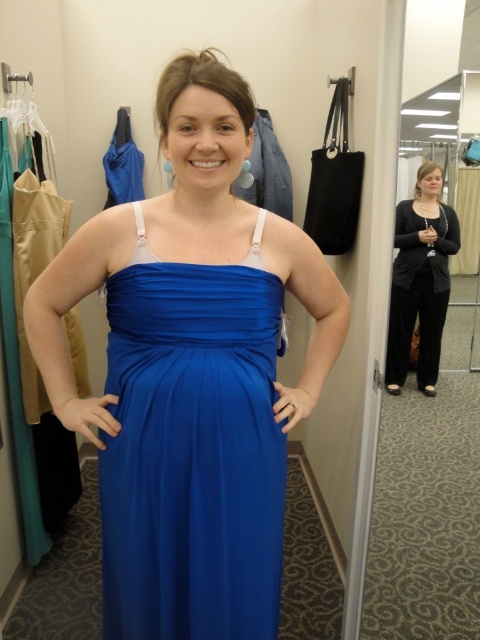
You are a fashion designer trying to decide whether to place the royal satin dress at center and the black matte cardigan at center on the same display rack. The rack has a width of 1.2 meters. Can both items fit side by side without overlapping?

The royal satin dress at center might be wider than the black matte cardigan at center, so it is uncertain if both can fit on the 1.2 meter rack. Check their individual widths first.

You are a fashion designer who needs to take precise measurements of the royal satin dress at center. You have a measuring tape that can extend up to 38 inches. Can you accurately measure the dress from where you are standing?

The royal satin dress at center is 37.98 inches away from viewer, so yes, the measuring tape can reach it since its maximum extension is 38 inches, which is just enough to measure the dress.

You are a fashion stylist helping a client choose between the royal blue satin dress at center and the black matte cardigan at center. The client wants to wear the item that is narrower. Which one should you recommend?

The royal blue satin dress at center is thinner than the black matte cardigan at center, so you should recommend the royal blue satin dress at center as it is narrower.